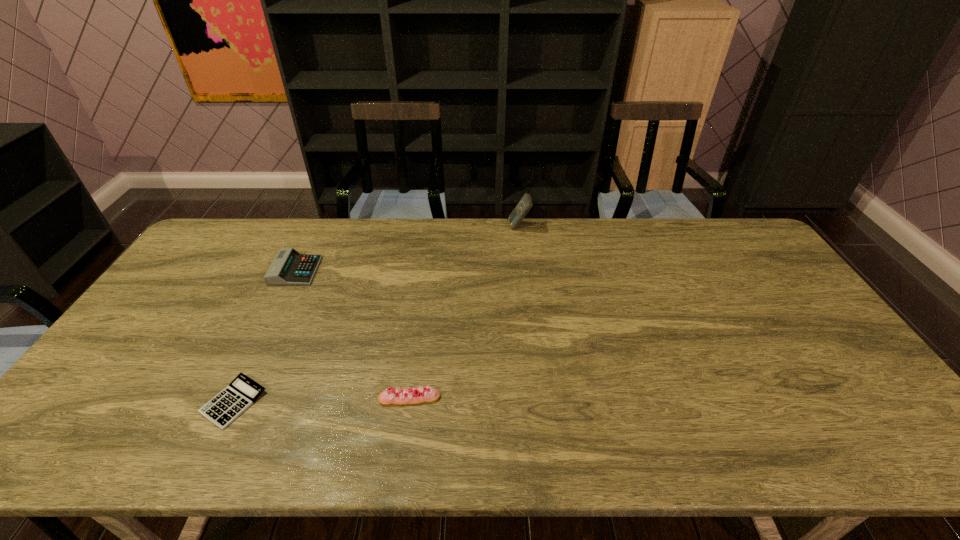
Locate an element on the screen. the tallest object is located at coordinates (525, 204).

At what (x,y) coordinates should I click in order to perform the action: click on the rightmost object. Please return your answer as a coordinate pair (x, y). The width and height of the screenshot is (960, 540). Looking at the image, I should click on (525, 204).

Where is `the second farthest calculator`? the second farthest calculator is located at coordinates (289, 267).

Find the location of `the third nearest object`. the third nearest object is located at coordinates (289, 267).

Locate an element on the screen. The image size is (960, 540). eclair is located at coordinates (404, 396).

Find the location of a particular element. The width and height of the screenshot is (960, 540). the nearest calculator is located at coordinates (242, 392).

The width and height of the screenshot is (960, 540). I want to click on the shortest object, so click(242, 392).

At what (x,y) coordinates should I click in order to perform the action: click on blank space located 0.090m on the front-facing side of the farthest object. Please return your answer as a coordinate pair (x, y). The image size is (960, 540). Looking at the image, I should click on (484, 227).

Find the location of a particular element. vacant space situated on the front-facing side of the farthest object is located at coordinates (470, 227).

Image resolution: width=960 pixels, height=540 pixels. In order to click on vacant position located 0.180m on the front-facing side of the farthest object in this screenshot , I will do `click(460, 227)`.